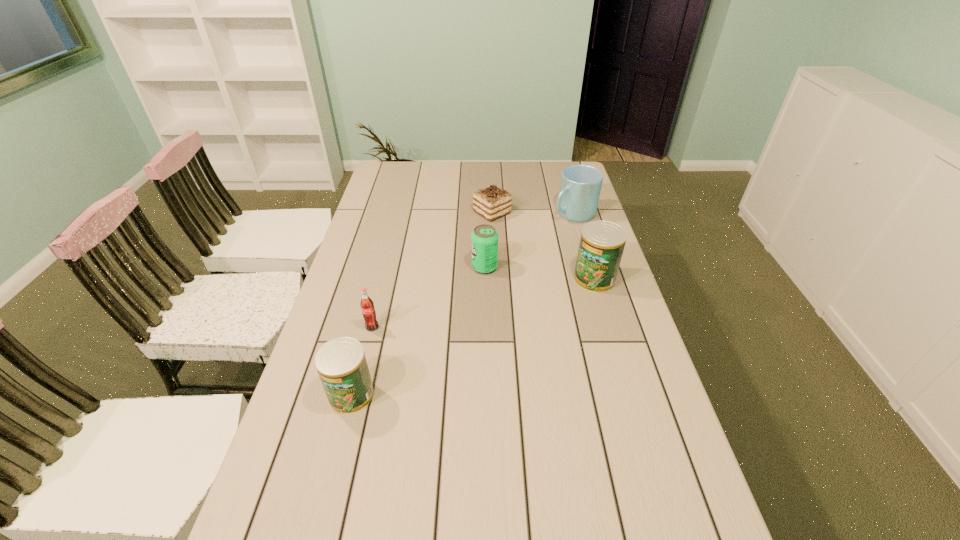
Locate an element on the screen. Image resolution: width=960 pixels, height=540 pixels. free space for an extra can to achieve even spacing is located at coordinates (489, 329).